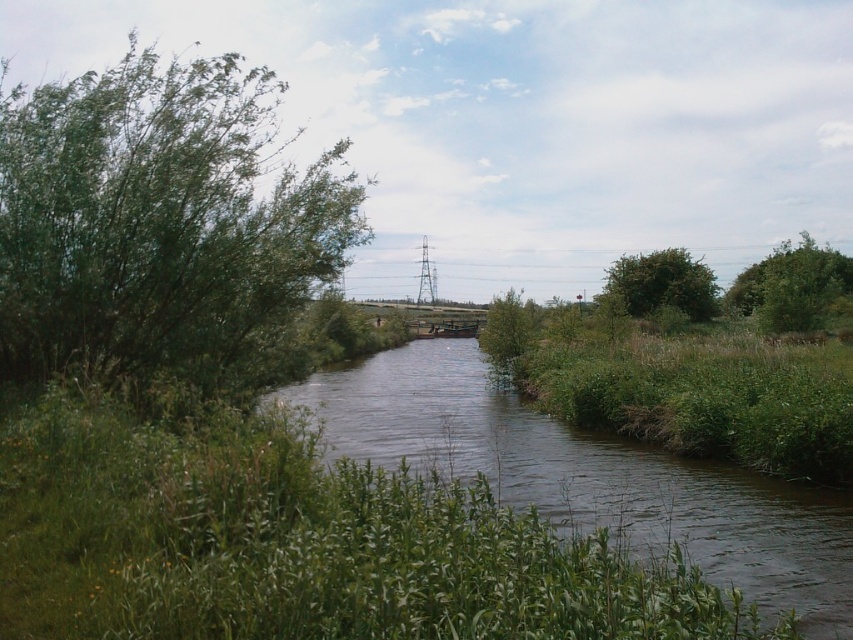
Measure the distance between point (18, 124) and camera.

Point (18, 124) is 14.55 meters away from camera.

Is green leafy bush at left further to the viewer compared to green leafy bush at right?

That is False.

Describe the element at coordinates (160, 227) in the screenshot. The height and width of the screenshot is (640, 853). I see `green leafy bush at left` at that location.

I want to click on green leafy bush at left, so click(160, 227).

In the scene shown: Does green leafy bush at left have a lesser width compared to green leafy tree at center?

Incorrect, green leafy bush at left's width is not less than green leafy tree at center's.

The width and height of the screenshot is (853, 640). What do you see at coordinates (160, 227) in the screenshot?
I see `green leafy bush at left` at bounding box center [160, 227].

Identify the location of green leafy bush at left. (160, 227).

Who is positioned more to the left, green leafy bush at left or dark green grass at center?

Positioned to the left is green leafy bush at left.

Measure the distance between green leafy bush at left and camera.

They are 33.63 feet apart.

Identify the location of green leafy bush at left. The height and width of the screenshot is (640, 853). (160, 227).

Identify the location of green leafy bush at left. The image size is (853, 640). (160, 227).